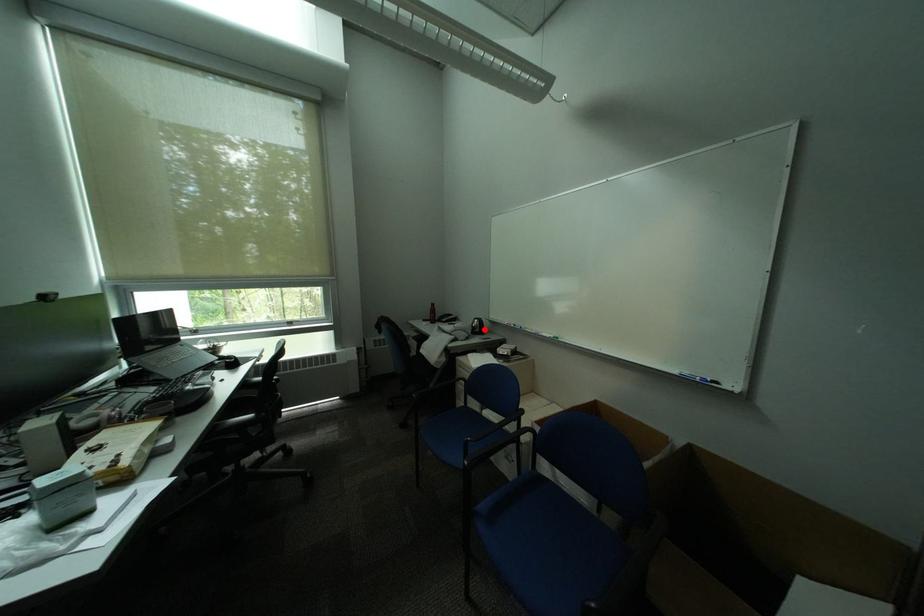
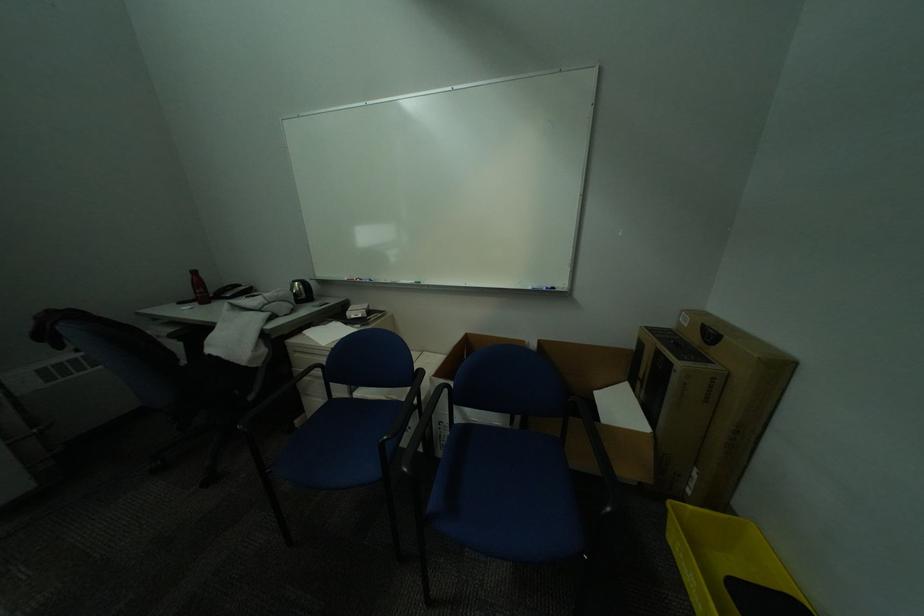
Locate, in the second image, the point that corresponds to the highlighted location in the first image.

(307, 296)